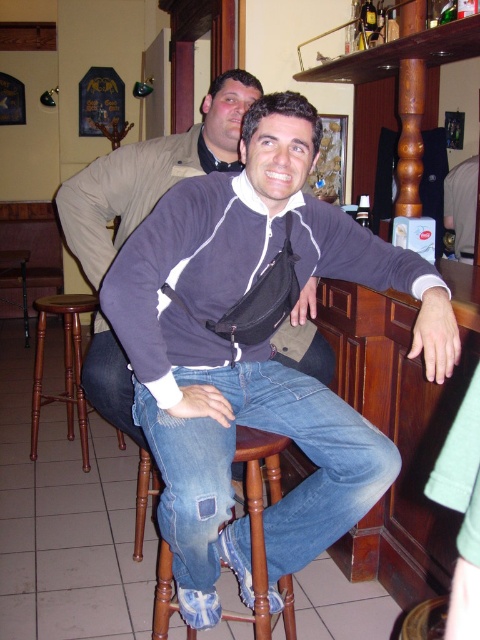
Does dark blue fleece at center appear on the right side of gray fabric shirt at upper right?

In fact, dark blue fleece at center is to the left of gray fabric shirt at upper right.

Between dark blue fleece at center and gray fabric shirt at upper right, which one appears on the right side from the viewer's perspective?

Positioned to the right is gray fabric shirt at upper right.

Is point (291, 193) positioned before point (446, 182)?

Yes, it is.

This screenshot has width=480, height=640. I want to click on dark blue fleece at center, so click(254, 355).

Between dark blue fleece at center and brown wooden stool at lower left, which one is positioned lower?

brown wooden stool at lower left is below.

Who is shorter, dark blue fleece at center or brown wooden stool at lower left?

brown wooden stool at lower left is shorter.

Find the location of `dark blue fleece at center`. dark blue fleece at center is located at coordinates (254, 355).

Does brown wooden stool at lower left appear over gray fabric shirt at upper right?

No, brown wooden stool at lower left is not above gray fabric shirt at upper right.

Locate an element on the screen. Image resolution: width=480 pixels, height=640 pixels. brown wooden stool at lower left is located at coordinates (63, 365).